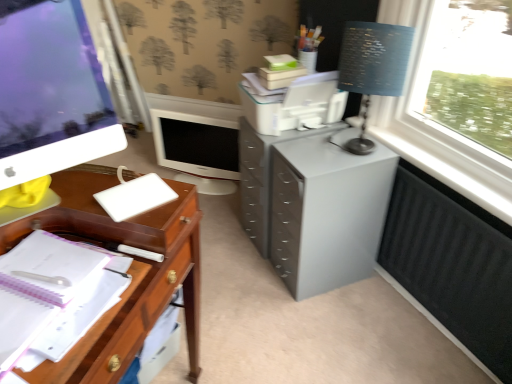
Question: Does white glossy computer monitor at center, the second computer monitor positioned from the front, have a greater height compared to white plastic pen at left?

Choices:
 (A) yes
 (B) no

Answer: (A)

Question: Is white glossy computer monitor at center, which is the 1th computer monitor in back-to-front order, outside of white plastic pen at left?

Choices:
 (A) yes
 (B) no

Answer: (A)

Question: Considering the relative sizes of white glossy computer monitor at center, which is the 1th computer monitor in back-to-front order, and white plastic pen at left in the image provided, is white glossy computer monitor at center, which is the 1th computer monitor in back-to-front order, smaller than white plastic pen at left?

Choices:
 (A) no
 (B) yes

Answer: (A)

Question: Does white glossy computer monitor at center, the second computer monitor positioned from the front, lie behind white plastic pen at left?

Choices:
 (A) no
 (B) yes

Answer: (B)

Question: Can you confirm if white glossy computer monitor at center, which is the 1th computer monitor in back-to-front order, is wider than white plastic pen at left?

Choices:
 (A) yes
 (B) no

Answer: (B)

Question: Considering their positions, is white glossy computer monitor at center, the second computer monitor positioned from the front, located in front of or behind black matte radiator at lower right?

Choices:
 (A) front
 (B) behind

Answer: (B)

Question: In terms of width, does white glossy computer monitor at center, which is the 1th computer monitor in back-to-front order, look wider or thinner when compared to black matte radiator at lower right?

Choices:
 (A) thin
 (B) wide

Answer: (B)

Question: From a real-world perspective, is white glossy computer monitor at center, the second computer monitor positioned from the front, above or below black matte radiator at lower right?

Choices:
 (A) above
 (B) below

Answer: (A)

Question: Is white glossy computer monitor at center, which is the 1th computer monitor in back-to-front order, to the left or to the right of black matte radiator at lower right in the image?

Choices:
 (A) right
 (B) left

Answer: (B)

Question: From a real-world perspective, relative to white glossy computer monitor at left, acting as the second computer monitor starting from the back, is black matte radiator at lower right vertically above or below?

Choices:
 (A) above
 (B) below

Answer: (B)

Question: In the image, is black matte radiator at lower right positioned in front of or behind white glossy computer monitor at left, acting as the second computer monitor starting from the back?

Choices:
 (A) front
 (B) behind

Answer: (B)

Question: Considering the positions of black matte radiator at lower right and white glossy computer monitor at left, acting as the second computer monitor starting from the back, in the image, is black matte radiator at lower right bigger or smaller than white glossy computer monitor at left, acting as the second computer monitor starting from the back,?

Choices:
 (A) big
 (B) small

Answer: (B)

Question: Considering the positions of black matte radiator at lower right and white glossy computer monitor at left, placed as the 1th computer monitor when sorted from front to back, in the image, is black matte radiator at lower right wider or thinner than white glossy computer monitor at left, placed as the 1th computer monitor when sorted from front to back,?

Choices:
 (A) wide
 (B) thin

Answer: (B)

Question: Considering the positions of white matte notebook at left and blue fabric lampshade at upper right in the image, is white matte notebook at left wider or thinner than blue fabric lampshade at upper right?

Choices:
 (A) thin
 (B) wide

Answer: (A)

Question: Do you think white matte notebook at left is within blue fabric lampshade at upper right, or outside of it?

Choices:
 (A) inside
 (B) outside

Answer: (B)